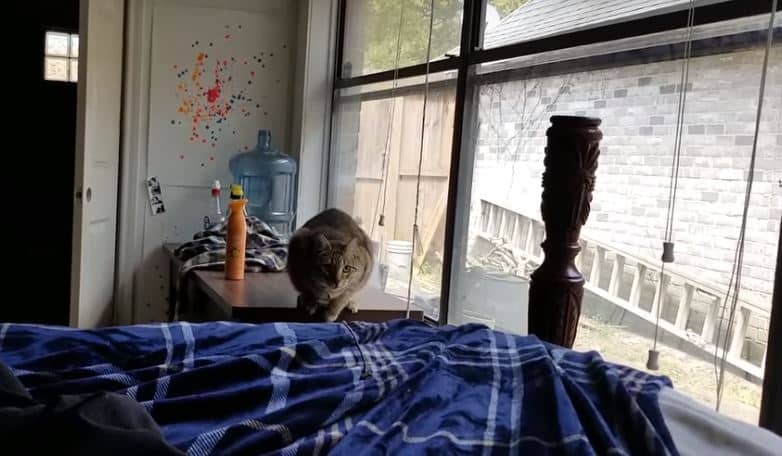
Where is `door`? Image resolution: width=782 pixels, height=456 pixels. door is located at coordinates (88, 187).